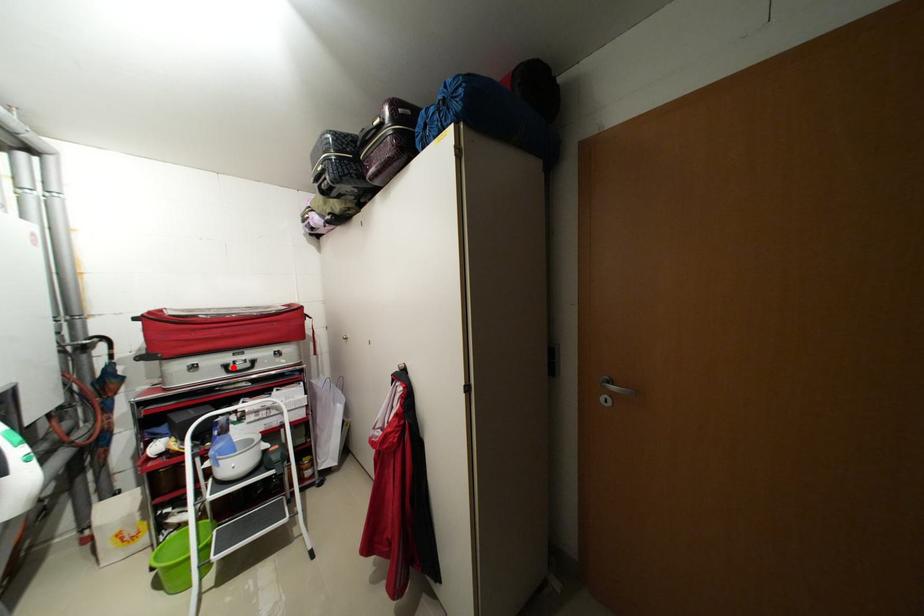
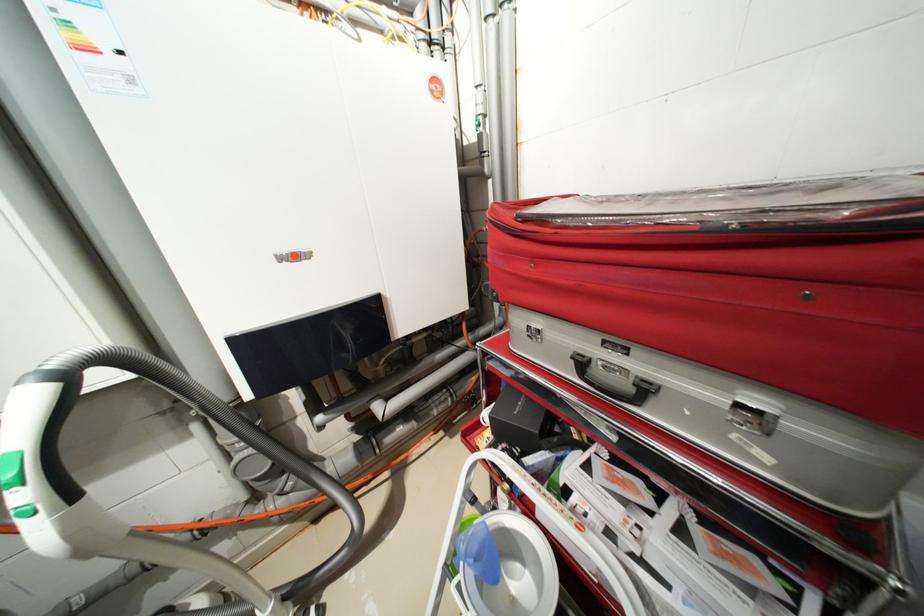
Where in the second image is the point corresponding to the highlighted location from the first image?

(589, 363)